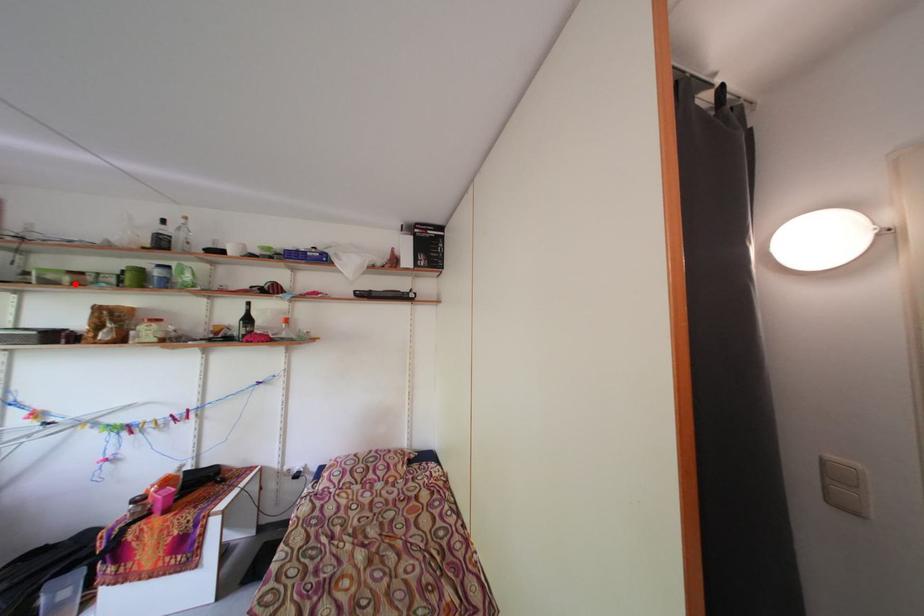
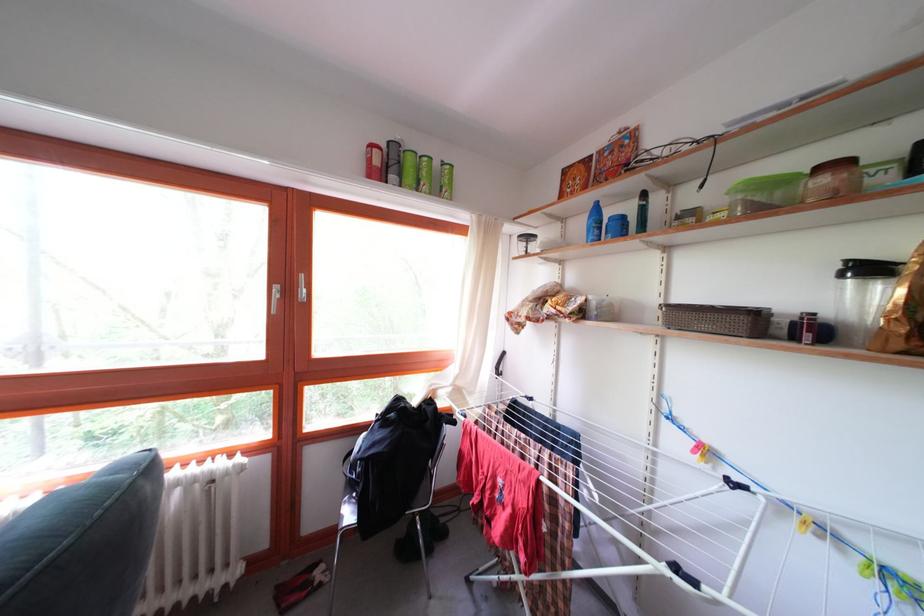
The point at the highlighted location is marked in the first image. Where is the corresponding point in the second image?

(832, 187)